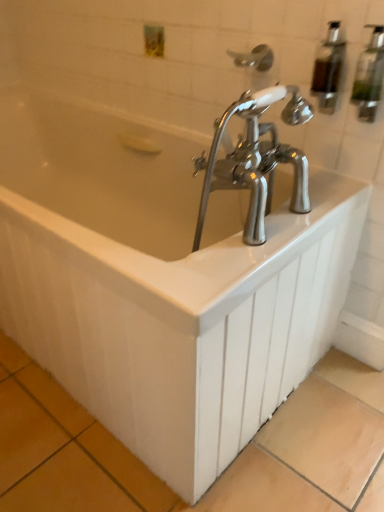
Question: Is translucent plastic soap dispenser at upper right, the first soap dispenser in the left-to-right sequence, to the left or to the right of clear glass soap dispenser at upper right, placed as the second soap dispenser when sorted from left to right, in the image?

Choices:
 (A) right
 (B) left

Answer: (B)

Question: Based on their sizes in the image, would you say translucent plastic soap dispenser at upper right, which is the second soap dispenser in right-to-left order, is bigger or smaller than clear glass soap dispenser at upper right, placed as the second soap dispenser when sorted from left to right?

Choices:
 (A) small
 (B) big

Answer: (A)

Question: Which object is positioned farthest from the clear glass soap dispenser at upper right, the first soap dispenser from the right?

Choices:
 (A) translucent plastic soap dispenser at upper right, the first soap dispenser in the left-to-right sequence
 (B) clear plastic shower head at upper center

Answer: (B)

Question: Based on their relative distances, which object is nearer to the clear plastic shower head at upper center?

Choices:
 (A) translucent plastic soap dispenser at upper right, the first soap dispenser in the left-to-right sequence
 (B) clear glass soap dispenser at upper right, placed as the second soap dispenser when sorted from left to right

Answer: (A)